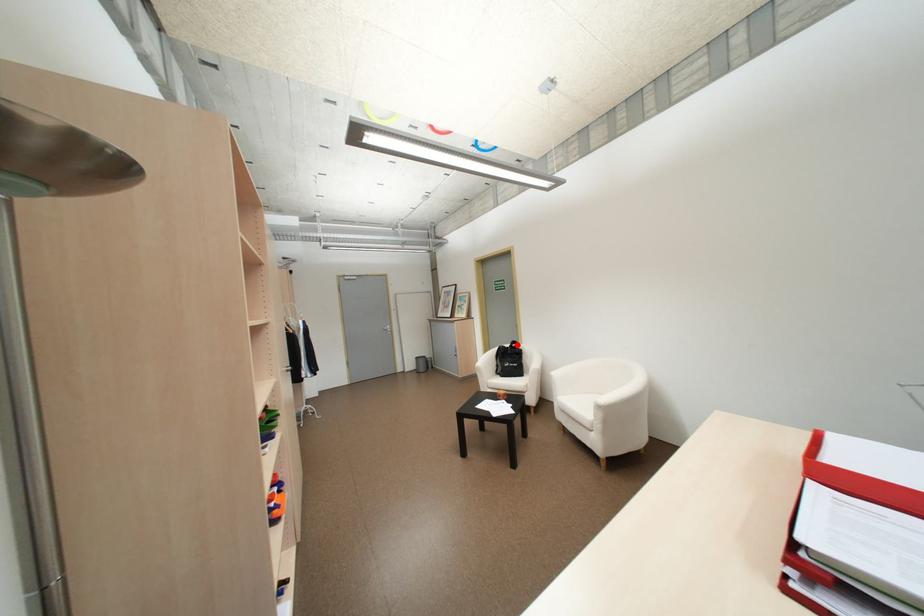
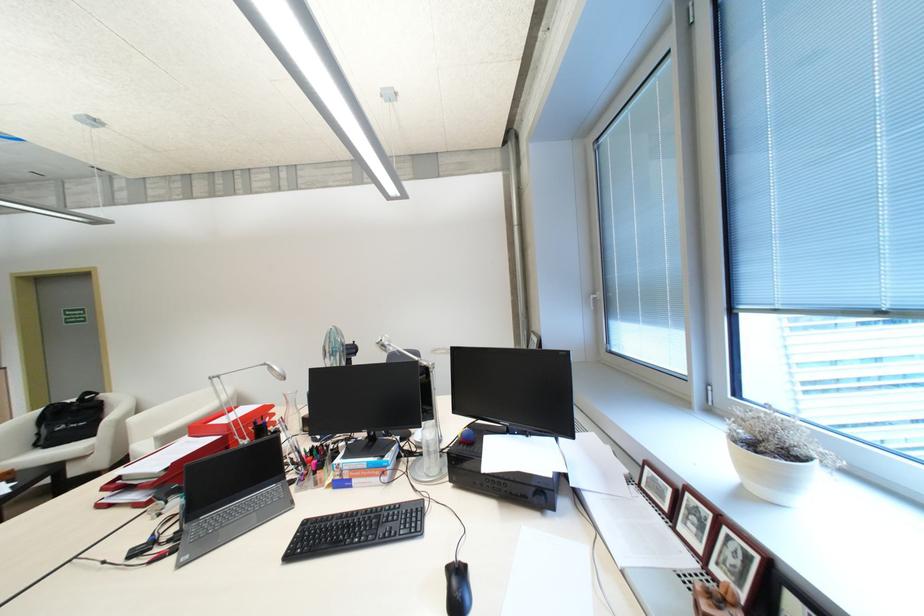
The point at the highlighted location is marked in the first image. Where is the corresponding point in the second image?

(82, 399)